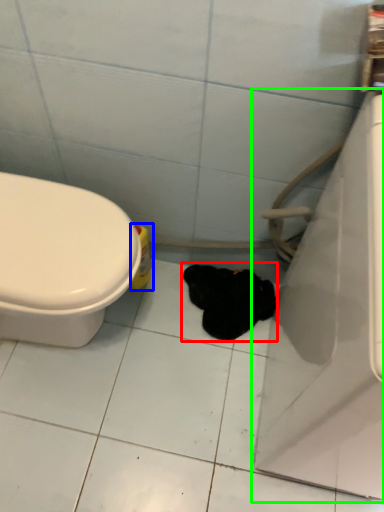
Question: Which is nearer to the animal (highlighted by a red box)? cleaning product (highlighted by a blue box) or bath (highlighted by a green box).

Choices:
 (A) cleaning product
 (B) bath

Answer: (A)